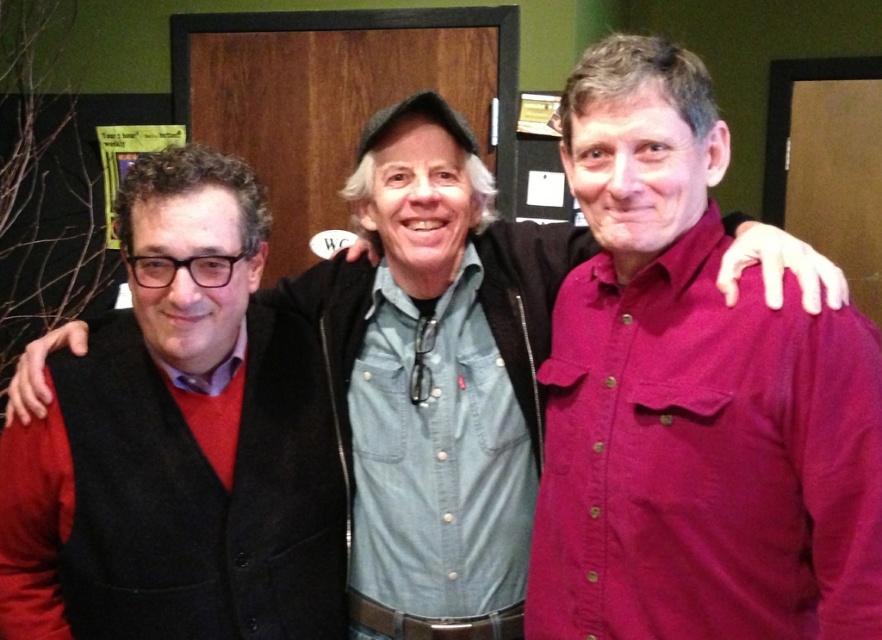
Question: Which of the following is the closest to the observer?

Choices:
 (A) (701, 561)
 (B) (28, 570)

Answer: (A)

Question: Is matte burgundy shirt at center above matte black vest at left?

Choices:
 (A) no
 (B) yes

Answer: (B)

Question: Is matte burgundy shirt at center wider than matte black vest at left?

Choices:
 (A) yes
 (B) no

Answer: (B)

Question: Which object appears farthest from the camera in this image?

Choices:
 (A) matte black vest at left
 (B) matte burgundy shirt at center

Answer: (A)

Question: Can you confirm if matte burgundy shirt at center is positioned to the left of matte black vest at left?

Choices:
 (A) yes
 (B) no

Answer: (B)